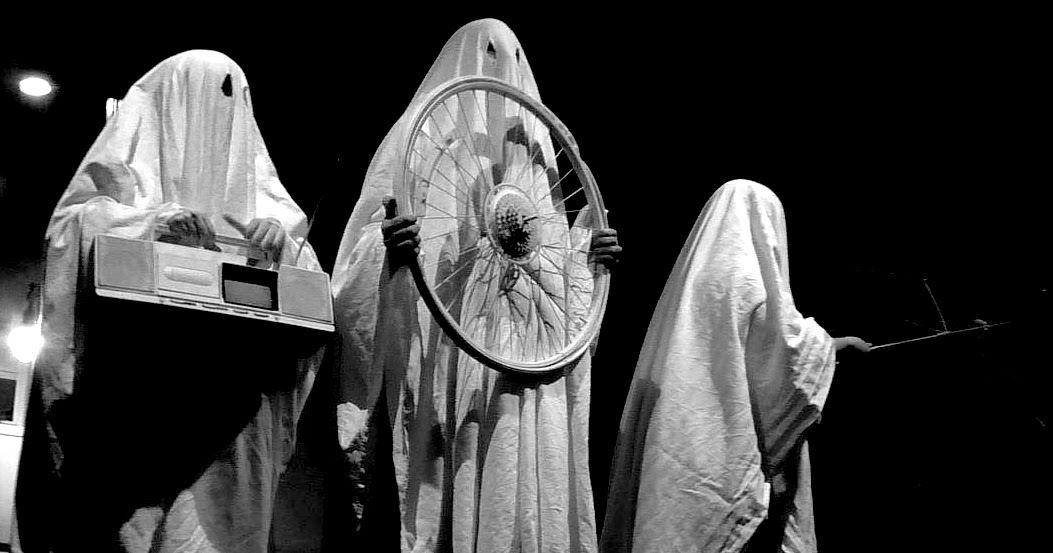
Identify the location of speaker. (297, 298).